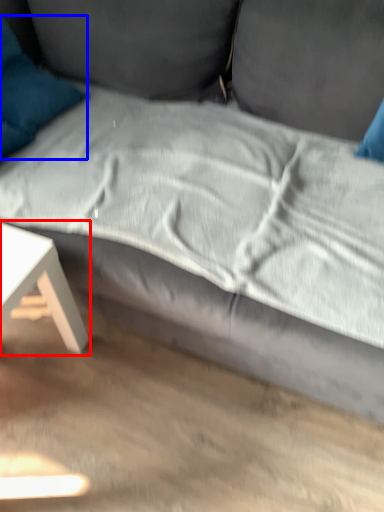
Question: Which object appears closest to the camera in this image, table (highlighted by a red box) or pillow (highlighted by a blue box)?

Choices:
 (A) table
 (B) pillow

Answer: (A)